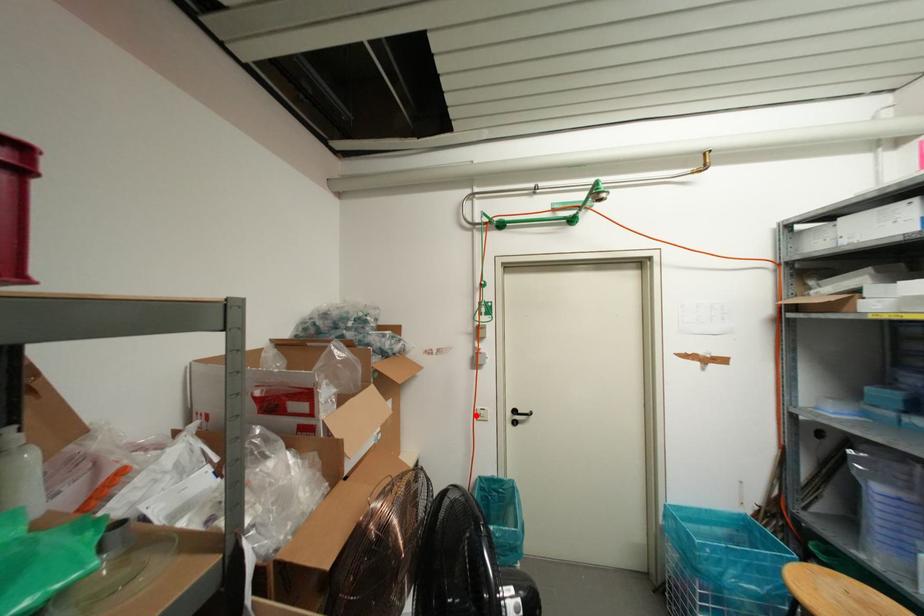
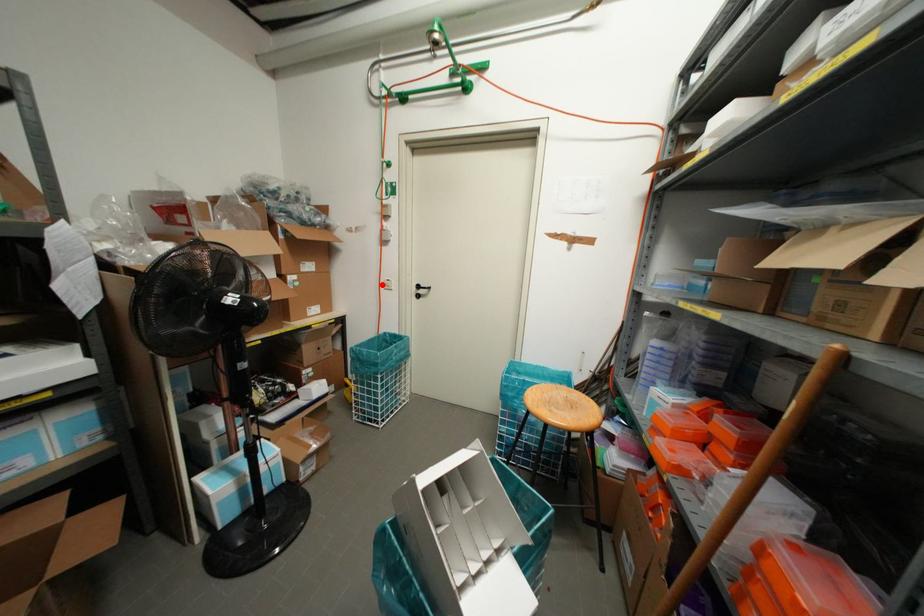
I am providing you with two images of the same scene from different viewpoints. A red point is marked on the first image and another point is marked on the second image. Does the point marked in image1 correspond to the same location as the one in image2?

Yes